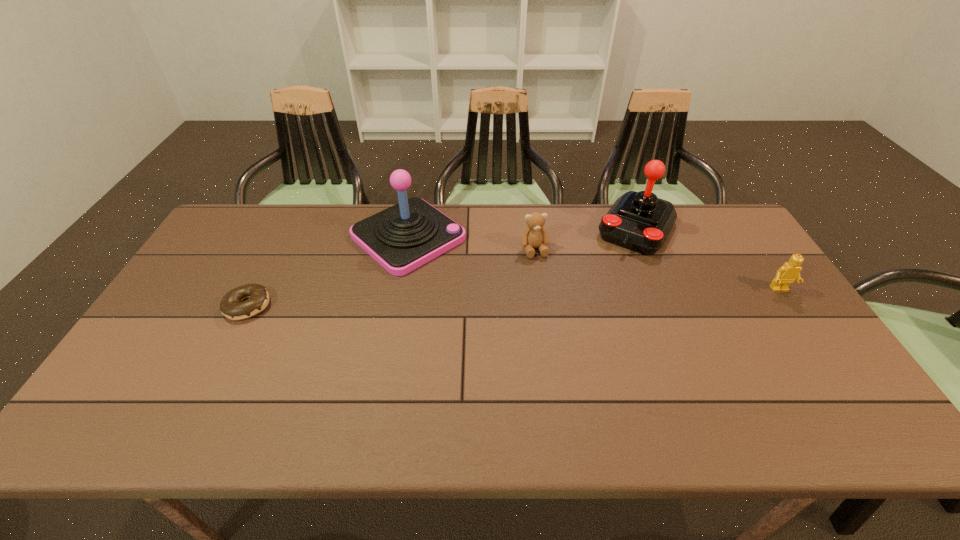
In the image, there is a desktop. Where is `free space at the far edge`? free space at the far edge is located at coordinates (588, 230).

What are the coordinates of `free space at the near edge of the desktop` in the screenshot? It's located at (710, 398).

Locate an element on the screen. This screenshot has height=540, width=960. vacant region at the left edge is located at coordinates (176, 298).

In the image, there is a desktop. Where is `free region at the right edge`? This screenshot has height=540, width=960. free region at the right edge is located at coordinates (770, 289).

This screenshot has width=960, height=540. I want to click on free location at the near left corner, so click(x=113, y=398).

Find the location of a particular element. This screenshot has height=540, width=960. vacant space at the far right corner of the desktop is located at coordinates point(723,240).

At what (x,y) coordinates should I click in order to perform the action: click on free spot between the right joystick and the rightmost object. Please return your answer as a coordinate pair (x, y). Looking at the image, I should click on [x=708, y=259].

Image resolution: width=960 pixels, height=540 pixels. I want to click on free space that is in between the third object from left to right and the fourth object from left to right, so click(x=586, y=239).

What are the coordinates of `vacant space that is in between the left joystick and the doughnut` in the screenshot? It's located at (328, 271).

Locate an element on the screen. vacant point located between the shortest object and the right joystick is located at coordinates (443, 267).